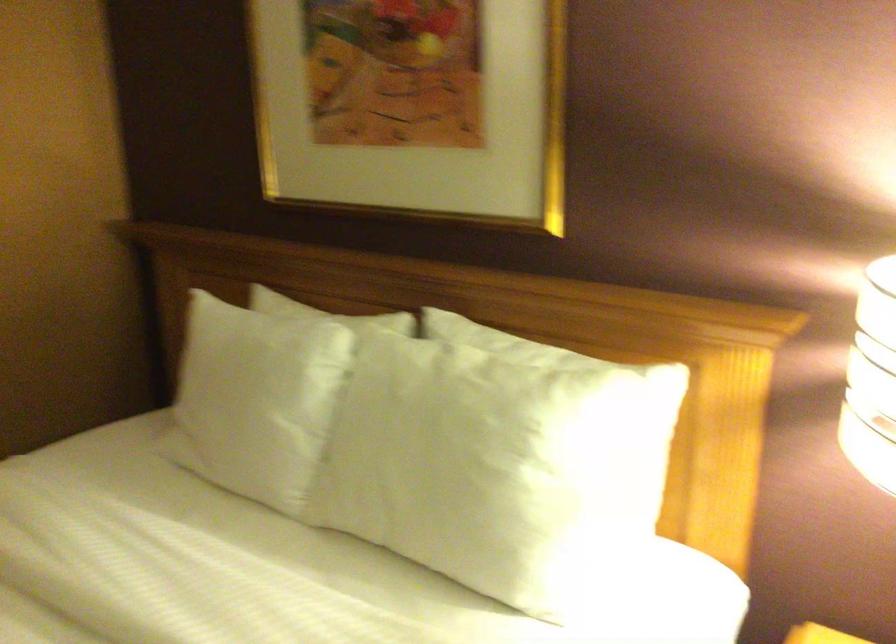
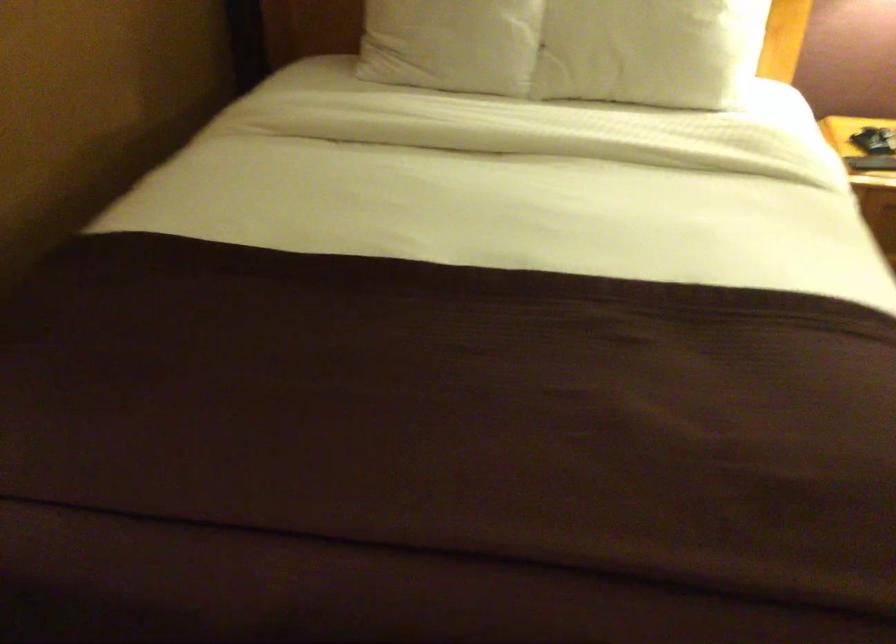
Where in the second image is the point corresponding to (x=222, y=433) from the first image?

(452, 44)